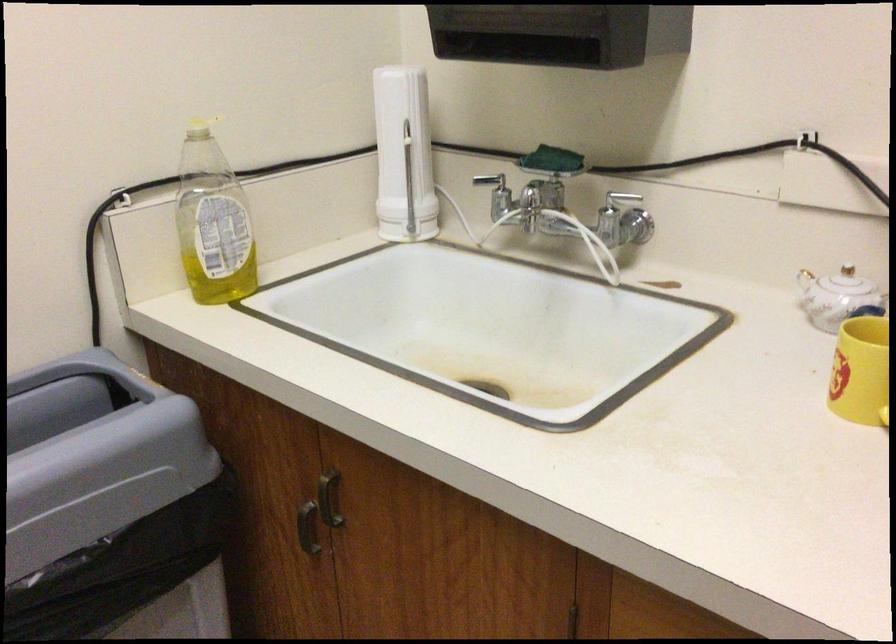
Locate an element on the screen. The height and width of the screenshot is (644, 896). dish soap pump is located at coordinates (200, 128).